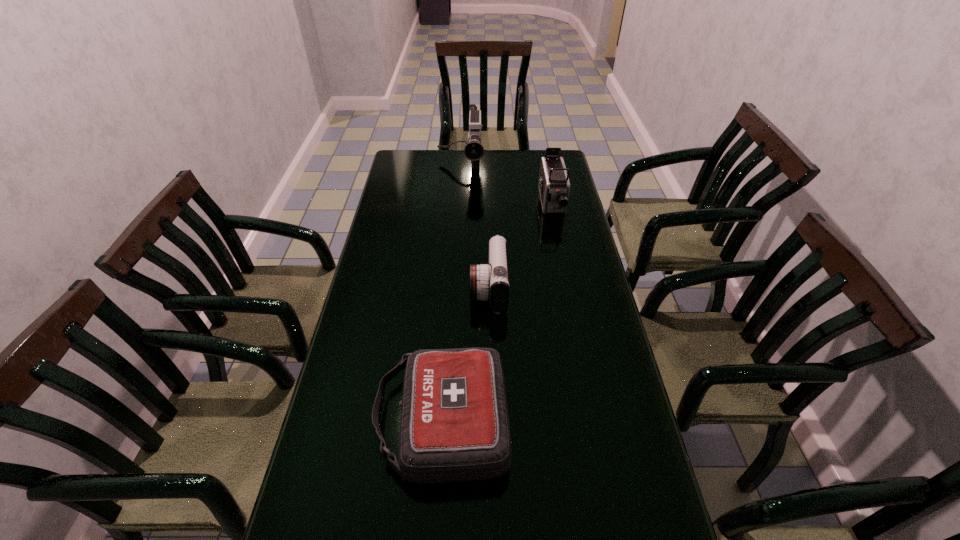
Find the location of a particular element. the farthest object is located at coordinates (474, 151).

The width and height of the screenshot is (960, 540). What are the coordinates of `the second farthest object` in the screenshot? It's located at (554, 186).

Locate an element on the screen. the rightmost object is located at coordinates (554, 186).

The image size is (960, 540). I want to click on the second shortest object, so click(490, 282).

The width and height of the screenshot is (960, 540). Identify the location of the third farthest object. (490, 282).

You are a GUI agent. You are given a task and a screenshot of the screen. Output one action in this format:
    pyautogui.click(x=<x>, y=<y>)
    Task: Click on the first-aid kit
    
    Given the screenshot: What is the action you would take?
    pyautogui.click(x=454, y=426)

I want to click on the shortest object, so click(x=454, y=426).

Locate an element on the screen. This screenshot has height=540, width=960. free space located 0.090m on the recording direction of the farthest object is located at coordinates (459, 196).

Locate an element on the screen. This screenshot has height=540, width=960. vacant point located at the lens of the rightmost camcorder is located at coordinates (561, 249).

The image size is (960, 540). I want to click on blank area located 0.160m on the surface of the second shortest object, so click(422, 289).